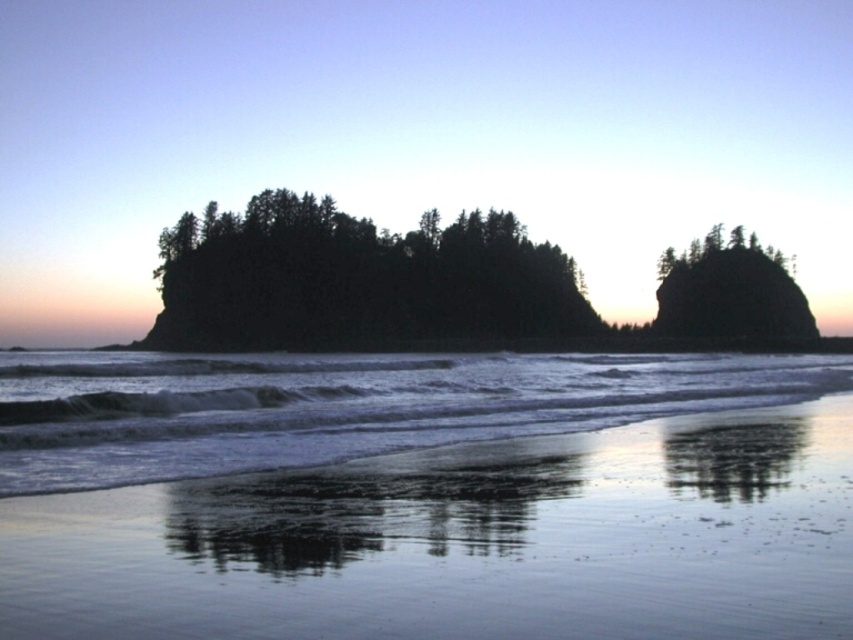
Question: Among these points, which one is nearest to the camera?

Choices:
 (A) (457, 230)
 (B) (164, 408)

Answer: (B)

Question: Is the position of clear water at lower center more distant than that of dark green forest at center?

Choices:
 (A) no
 (B) yes

Answer: (A)

Question: Observing the image, what is the correct spatial positioning of clear water at lower center in reference to dark green forest at center?

Choices:
 (A) below
 (B) above

Answer: (A)

Question: Does clear water at lower center have a smaller size compared to dark green forest at center?

Choices:
 (A) no
 (B) yes

Answer: (B)

Question: Among these objects, which one is farthest from the camera?

Choices:
 (A) clear water at lower center
 (B) dark green forest at center

Answer: (B)

Question: Which point appears farthest from the camera in this image?

Choices:
 (A) (490, 422)
 (B) (306, 262)

Answer: (B)